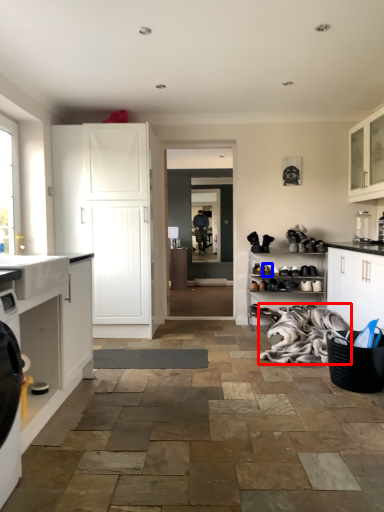
Question: Which point is further to the camera, material (highlighted by a red box) or shoe (highlighted by a blue box)?

Choices:
 (A) material
 (B) shoe

Answer: (B)